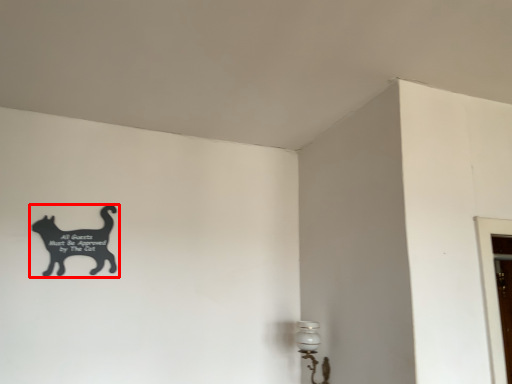
Question: Considering the relative positions of cat (annotated by the red box) and lamp in the image provided, where is cat (annotated by the red box) located with respect to the staircase?

Choices:
 (A) left
 (B) right

Answer: (A)